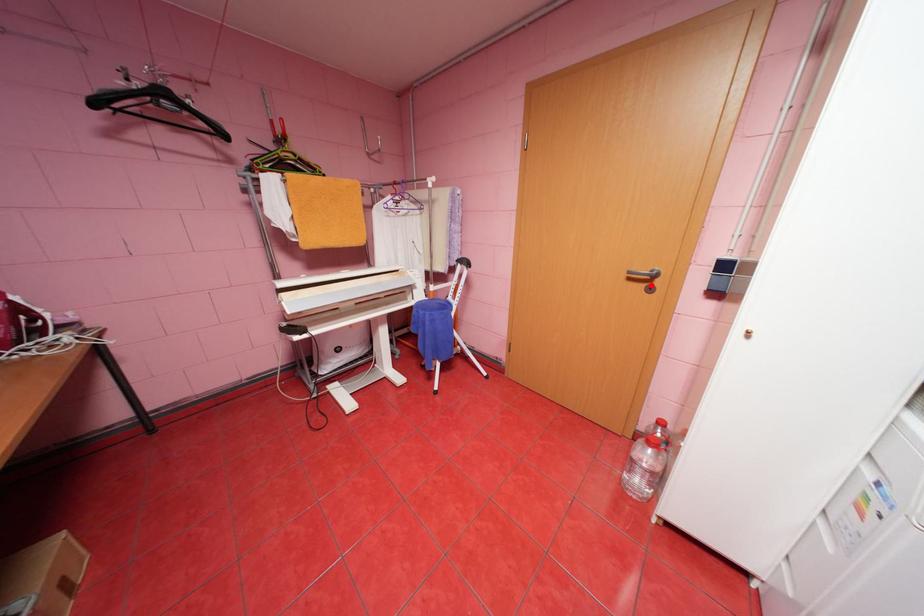
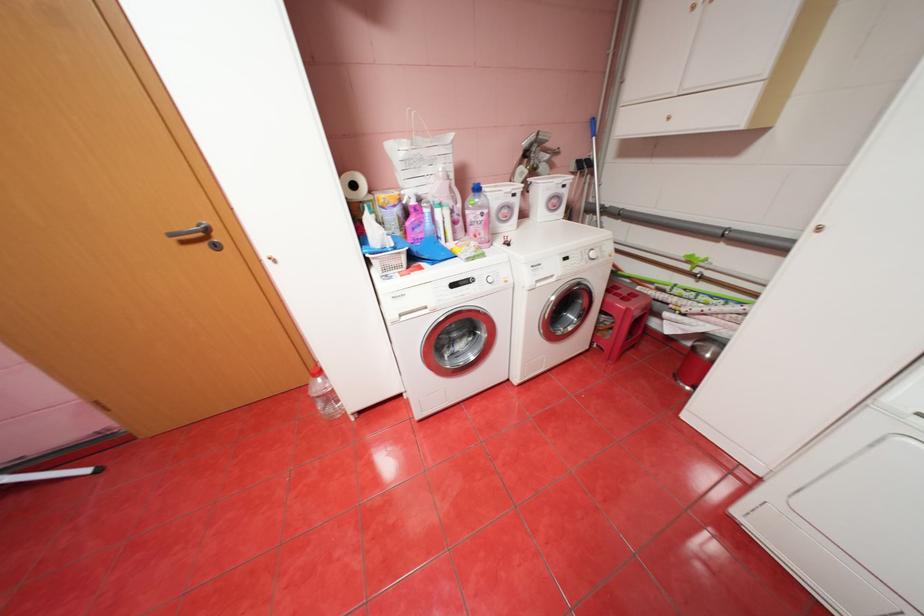
Find the pixel in the second image that matches the highlighted location in the first image.

(213, 245)